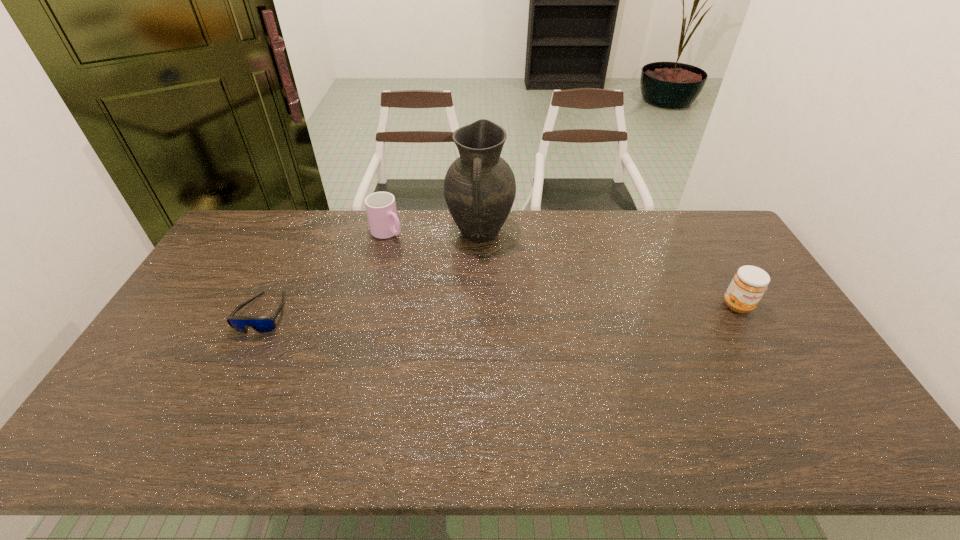
The image size is (960, 540). In order to click on vacant space at the far right corner of the desktop in this screenshot , I will do `click(694, 225)`.

At what (x,y) coordinates should I click in order to perform the action: click on free region at the near right corner of the desktop. Please return your answer as a coordinate pair (x, y). Image resolution: width=960 pixels, height=540 pixels. Looking at the image, I should click on (828, 402).

Find the location of a particular element. Image resolution: width=960 pixels, height=540 pixels. free area in between the jam and the third object from right to left is located at coordinates (563, 269).

At what (x,y) coordinates should I click in order to perform the action: click on free space between the leftmost object and the jam. Please return your answer as a coordinate pair (x, y). This screenshot has width=960, height=540. Looking at the image, I should click on (500, 309).

The height and width of the screenshot is (540, 960). Identify the location of free space between the pitcher and the cup. 434,233.

You are a GUI agent. You are given a task and a screenshot of the screen. Output one action in this format:
    pyautogui.click(x=<x>, y=<y>)
    Task: Click on the vacant area that lies between the sunglasses and the jam
    Image resolution: width=960 pixels, height=540 pixels.
    Given the screenshot: What is the action you would take?
    pyautogui.click(x=500, y=309)

Identify the location of free area in between the second object from left to right and the tallest object. The height and width of the screenshot is (540, 960). (434, 233).

You are a GUI agent. You are given a task and a screenshot of the screen. Output one action in this format:
    pyautogui.click(x=<x>, y=<y>)
    Task: Click on the vacant space that is in between the leftmost object and the third object from left to right
    
    Given the screenshot: What is the action you would take?
    pyautogui.click(x=372, y=273)

Image resolution: width=960 pixels, height=540 pixels. I want to click on vacant area that lies between the tallest object and the sunglasses, so click(372, 273).

The width and height of the screenshot is (960, 540). In order to click on vacant area between the tallest object and the rightmost object in this screenshot , I will do `click(609, 269)`.